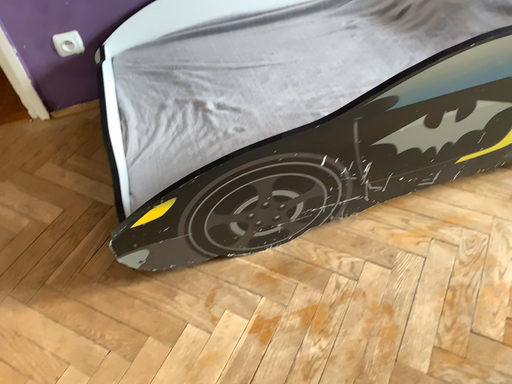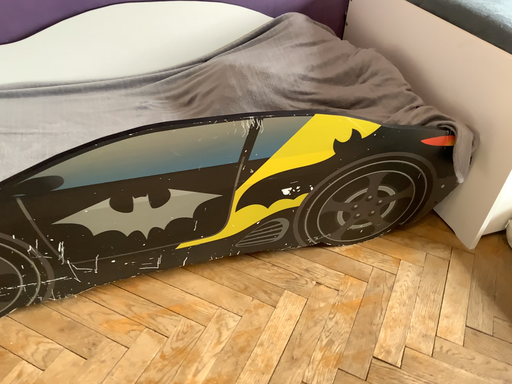
Question: Which way did the camera rotate in the video?

Choices:
 (A) rotated downward
 (B) rotated upward

Answer: (B)